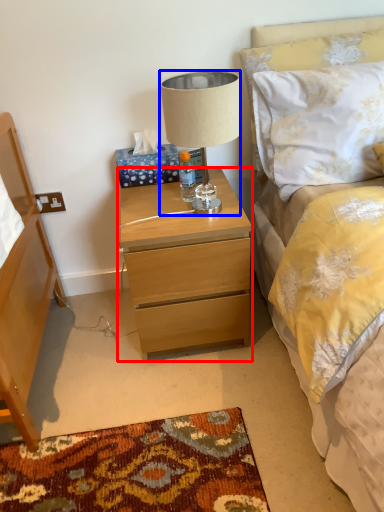
Question: Which object appears closest to the camera in this image, nightstand (highlighted by a red box) or lamp (highlighted by a blue box)?

Choices:
 (A) nightstand
 (B) lamp

Answer: (B)